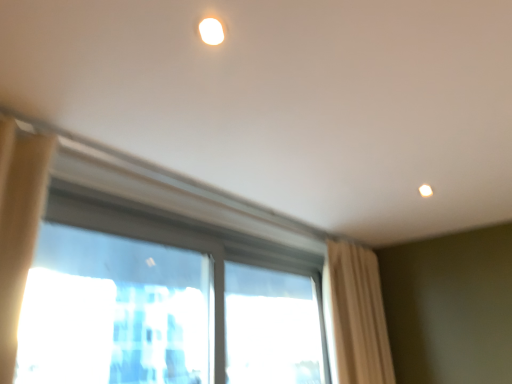
Question: Considering the relative positions of transparent glass window at center, the second window positioned from the right, and transparent glass window at center in the image provided, is transparent glass window at center, the second window positioned from the right, to the right of transparent glass window at center from the viewer's perspective?

Choices:
 (A) no
 (B) yes

Answer: (B)

Question: Is transparent glass window at center, acting as the 1th window starting from the left, touching transparent glass window at center?

Choices:
 (A) no
 (B) yes

Answer: (A)

Question: Can you confirm if transparent glass window at center, acting as the 1th window starting from the left, is shorter than transparent glass window at center?

Choices:
 (A) no
 (B) yes

Answer: (B)

Question: From the image's perspective, does transparent glass window at center, the second window positioned from the right, appear higher than transparent glass window at center?

Choices:
 (A) yes
 (B) no

Answer: (B)

Question: Is there a large distance between transparent glass window at center, acting as the 1th window starting from the left, and transparent glass window at center?

Choices:
 (A) yes
 (B) no

Answer: (A)

Question: From the image's perspective, would you say transparent glass window at center, acting as the 1th window starting from the left, is shown under transparent glass window at center?

Choices:
 (A) no
 (B) yes

Answer: (B)

Question: From a real-world perspective, is beige fabric curtain at right positioned under transparent glass window at center, acting as the 1th window starting from the right, based on gravity?

Choices:
 (A) yes
 (B) no

Answer: (B)

Question: Considering the relative sizes of beige fabric curtain at right and transparent glass window at center, acting as the 1th window starting from the right, in the image provided, is beige fabric curtain at right thinner than transparent glass window at center, acting as the 1th window starting from the right,?

Choices:
 (A) yes
 (B) no

Answer: (B)

Question: From the image's perspective, is beige fabric curtain at right located beneath transparent glass window at center, marked as the 2th window in a left-to-right arrangement?

Choices:
 (A) no
 (B) yes

Answer: (A)

Question: Can you confirm if beige fabric curtain at right is positioned to the left of transparent glass window at center, acting as the 1th window starting from the right?

Choices:
 (A) yes
 (B) no

Answer: (B)

Question: Is beige fabric curtain at right far away from transparent glass window at center, marked as the 2th window in a left-to-right arrangement?

Choices:
 (A) no
 (B) yes

Answer: (A)

Question: Considering the relative sizes of beige fabric curtain at right and transparent glass window at center, marked as the 2th window in a left-to-right arrangement, in the image provided, is beige fabric curtain at right wider than transparent glass window at center, marked as the 2th window in a left-to-right arrangement,?

Choices:
 (A) no
 (B) yes

Answer: (B)

Question: Can you confirm if transparent glass window at center is smaller than transparent glass window at center, acting as the 1th window starting from the left?

Choices:
 (A) no
 (B) yes

Answer: (A)